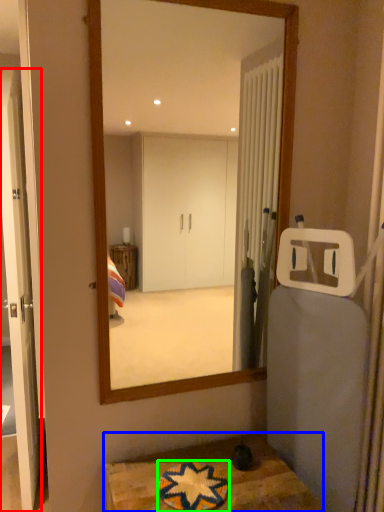
Question: Based on their relative distances, which object is farther from door (highlighted by a red box)? Choose from table (highlighted by a blue box) and bath mat (highlighted by a green box).

Choices:
 (A) table
 (B) bath mat

Answer: (B)